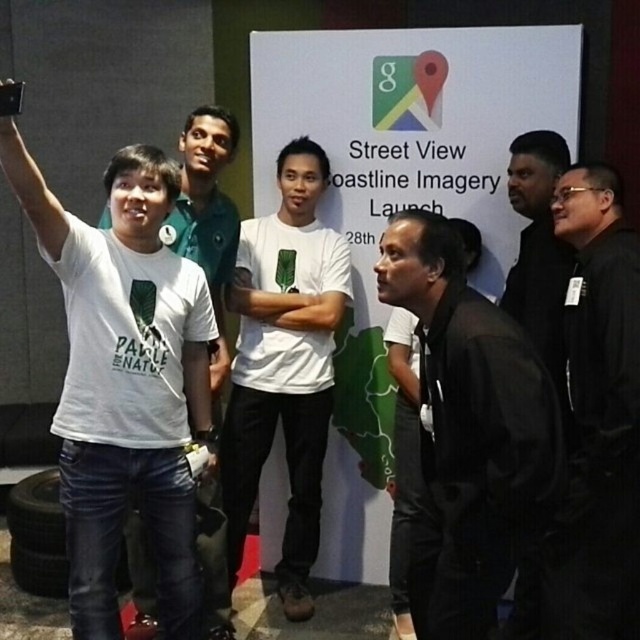
Which is more to the left, black leather jacket at center or white cotton t-shirt at left?

white cotton t-shirt at left

Consider the image. Does black leather jacket at center have a lesser width compared to white cotton t-shirt at left?

Incorrect, black leather jacket at center's width is not less than white cotton t-shirt at left's.

Does point (412, 618) come in front of point (221, 122)?

Yes, it is in front of point (221, 122).

The width and height of the screenshot is (640, 640). What are the coordinates of `black leather jacket at center` in the screenshot? It's located at (468, 432).

Is white matte t-shirt at center bigger than white cotton t-shirt at left?

Correct, white matte t-shirt at center is larger in size than white cotton t-shirt at left.

Who is shorter, white matte t-shirt at center or white cotton t-shirt at left?

white cotton t-shirt at left is shorter.

The image size is (640, 640). In order to click on white matte t-shirt at center in this screenshot , I will do `click(284, 364)`.

Does black matte jacket at right have a larger size compared to white cotton t-shirt at left?

Incorrect, black matte jacket at right is not larger than white cotton t-shirt at left.

Between black matte jacket at right and white cotton t-shirt at left, which one has more height?

black matte jacket at right is taller.

Between point (604, 452) and point (200, 536), which one is positioned behind?

Point (200, 536)

The width and height of the screenshot is (640, 640). I want to click on black matte jacket at right, so click(602, 401).